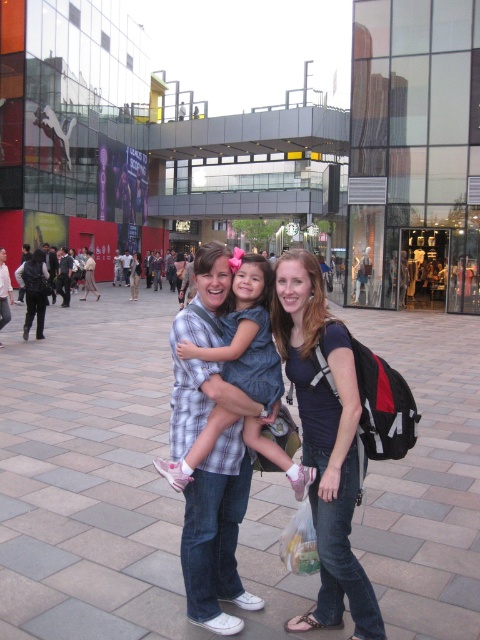
You are standing in the urban scene and want to move from the point at coordinates point (337, 584) to the point at coordinates point (215, 436). Which direction should you move in to get closer to your destination?

You should move forward because point (337, 584) is further to the viewer than point (215, 436), so moving forward will bring you closer to the destination.

You are a photographer trying to capture the best angle of the scene. You notice two points marked in the image. Which point, point (298, 116) or point (260, 371), is closer to you?

Point (298, 116) is closer to you because it is further to the viewer than point (260, 371).

You are a photographer trying to capture a photo of the two central figures in the scene. The matte blue shirt at center and the plaid fabric dress at center are both important subjects. Based on their positions, which one should you focus on first to ensure both are in sharp focus?

The matte blue shirt at center is located below the plaid fabric dress at center, so you should focus on the plaid fabric dress at center first since it is higher up and focusing there will keep both in focus more effectively.